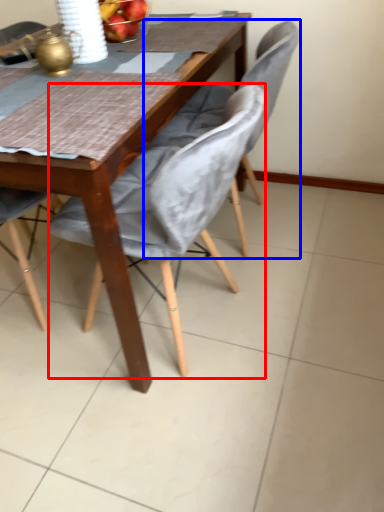
Question: Which object appears farthest to the camera in this image, chair (highlighted by a red box) or chair (highlighted by a blue box)?

Choices:
 (A) chair
 (B) chair

Answer: (B)